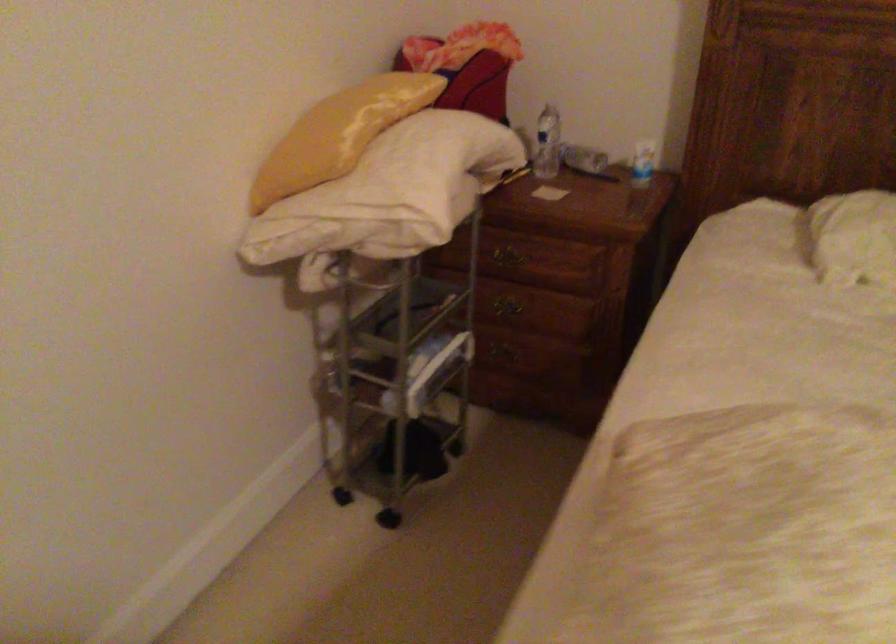
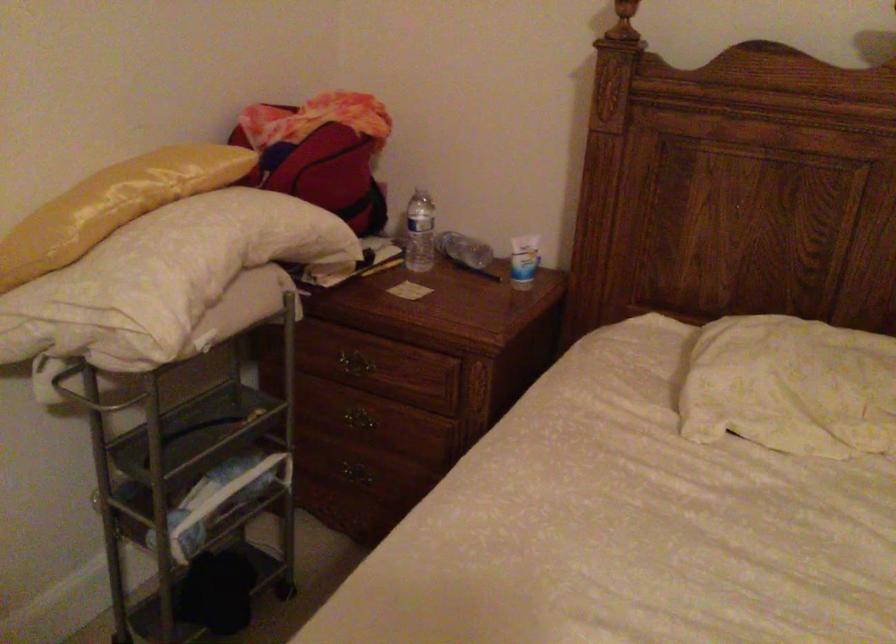
Locate, in the second image, the point that corresponds to pixel 647 162 in the first image.

(523, 261)